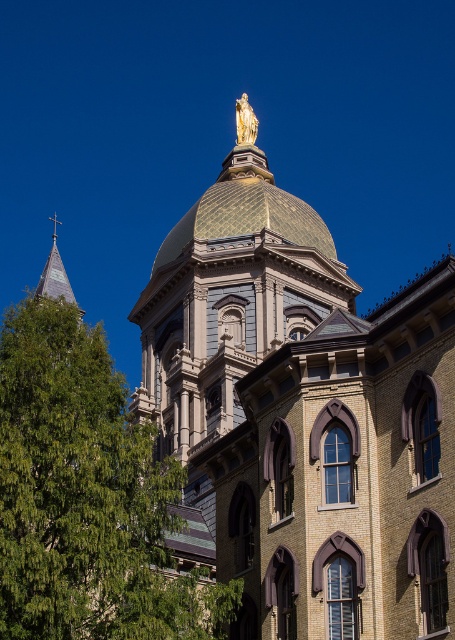
Is point (3, 417) less distant than point (182, 224)?

Yes, it is.

Is point (158, 620) farther from camera compared to point (303, 200)?

No, (158, 620) is in front of (303, 200).

Between point (146, 532) and point (175, 250), which one is positioned in front?

Positioned in front is point (146, 532).

Identify the location of green leafy tree at lower left. (86, 497).